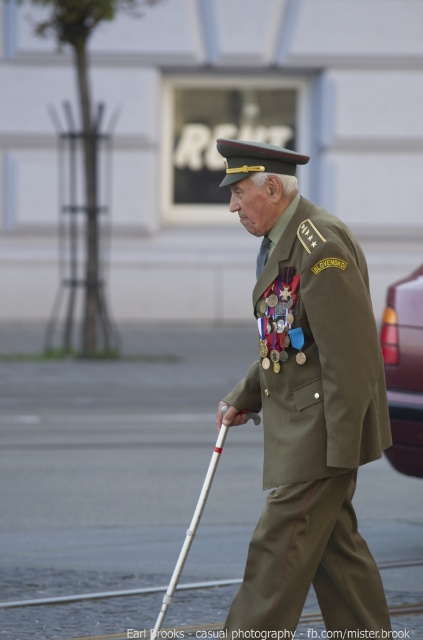
Can you confirm if olive-green uniform at center is bigger than white plastic crutch at center?

Correct, olive-green uniform at center is larger in size than white plastic crutch at center.

Who is positioned more to the left, olive-green uniform at center or white plastic crutch at center?

Positioned to the left is white plastic crutch at center.

Find the location of a particular element. The image size is (423, 640). olive-green uniform at center is located at coordinates (305, 403).